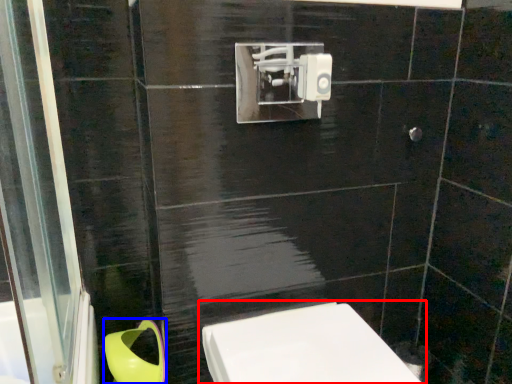
Question: Which object appears closest to the camera in this image, toilet (highlighted by a red box) or toilet bowl (highlighted by a blue box)?

Choices:
 (A) toilet
 (B) toilet bowl

Answer: (A)